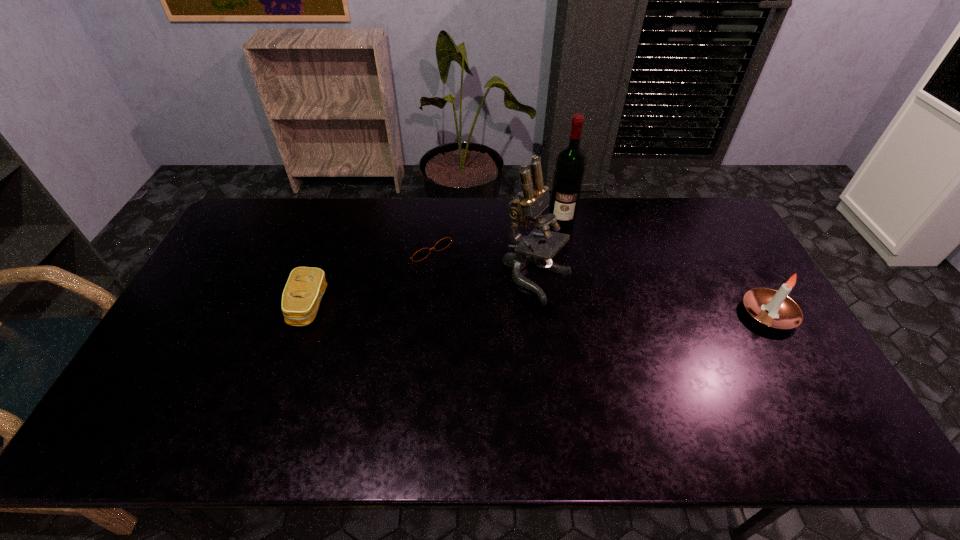
Locate an element on the screen. the fourth tallest object is located at coordinates (305, 287).

Locate an element on the screen. Image resolution: width=960 pixels, height=540 pixels. the leftmost object is located at coordinates (305, 287).

You are a GUI agent. You are given a task and a screenshot of the screen. Output one action in this format:
    pyautogui.click(x=<x>, y=<y>)
    Task: Click on the candle
    This screenshot has height=540, width=960.
    Given the screenshot: What is the action you would take?
    pyautogui.click(x=771, y=308)

The image size is (960, 540). Find the location of `the rightmost object`. the rightmost object is located at coordinates (771, 308).

Where is `the shortest object`? the shortest object is located at coordinates (443, 243).

Image resolution: width=960 pixels, height=540 pixels. Identify the location of the second object from left to right. (443, 243).

The image size is (960, 540). Find the location of `alcohol`. alcohol is located at coordinates (570, 165).

Where is `microscope`? This screenshot has width=960, height=540. microscope is located at coordinates (538, 247).

Find the location of a particular element. The image size is (960, 540). vacant space located on the zipper side of the clutch bag is located at coordinates (223, 306).

Find the location of a particular element. vacant space located on the zipper side of the clutch bag is located at coordinates (240, 306).